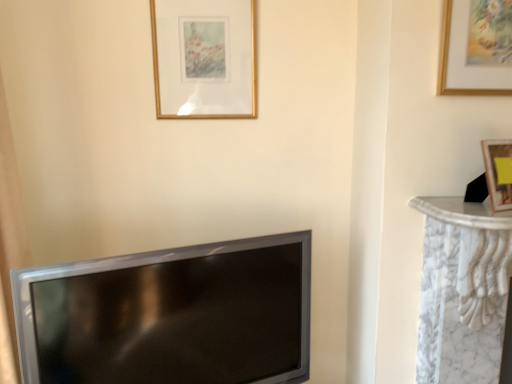
Question: Is gold wooden picture frame at upper right, acting as the 1th picture frame starting from the right, in front of or behind matte black tv at lower left in the image?

Choices:
 (A) behind
 (B) front

Answer: (A)

Question: In terms of height, does gold wooden picture frame at upper right, the first picture frame from the front, look taller or shorter compared to matte black tv at lower left?

Choices:
 (A) tall
 (B) short

Answer: (B)

Question: Based on their relative distances, which object is farther from the gold wooden picture frame at upper center, which is the first picture frame from left to right?

Choices:
 (A) matte black tv at lower left
 (B) gold wooden picture frame at upper right, which is counted as the second picture frame, starting from the back

Answer: (B)

Question: Which of these objects is positioned closest to the gold wooden picture frame at upper center, which ranks as the 2th picture frame in right-to-left order?

Choices:
 (A) matte black tv at lower left
 (B) gold wooden picture frame at upper right, acting as the 1th picture frame starting from the right

Answer: (A)